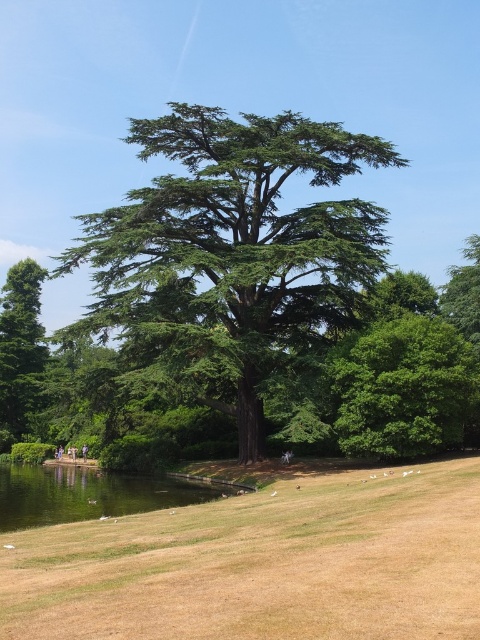
Can you confirm if green textured tree at center is wider than green matte tree at left?

Yes, green textured tree at center is wider than green matte tree at left.

Describe the element at coordinates (232, 252) in the screenshot. The image size is (480, 640). I see `green textured tree at center` at that location.

Is point (179, 205) farther from camera compared to point (34, 301)?

No, it is not.

Locate an element on the screen. The height and width of the screenshot is (640, 480). green textured tree at center is located at coordinates [x=232, y=252].

Does brown grass at lower center appear on the right side of green leafy tree at center?

In fact, brown grass at lower center is to the left of green leafy tree at center.

Who is taller, brown grass at lower center or green leafy tree at center?

With more height is green leafy tree at center.

Which is behind, point (326, 536) or point (444, 355)?

The point (444, 355) is behind.

Where is `brown grass at lower center`? This screenshot has width=480, height=640. brown grass at lower center is located at coordinates (262, 564).

Does brown grass at lower center appear on the left side of green textured tree at center?

In fact, brown grass at lower center is to the right of green textured tree at center.

Is brown grass at lower center positioned in front of green textured tree at center?

Yes, it is.

Find the location of a particular element. The height and width of the screenshot is (640, 480). brown grass at lower center is located at coordinates (262, 564).

In order to click on brown grass at lower center in this screenshot , I will do `click(262, 564)`.